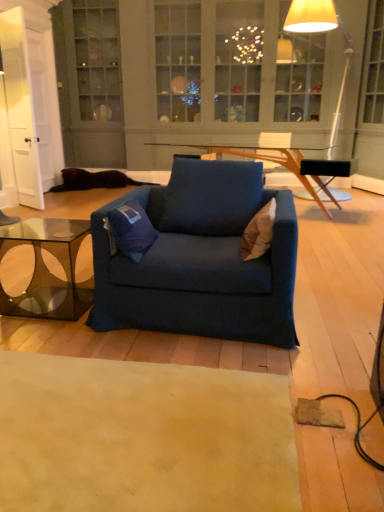
Question: Can you confirm if matte white floor lamp at upper right is smaller than blue fabric pillow at center, the 2th pillow when ordered from right to left?

Choices:
 (A) yes
 (B) no

Answer: (B)

Question: Is matte white floor lamp at upper right positioned beyond the bounds of blue fabric pillow at center, the first pillow from the left?

Choices:
 (A) yes
 (B) no

Answer: (A)

Question: Considering the relative sizes of matte white floor lamp at upper right and blue fabric pillow at center, the first pillow from the left, in the image provided, is matte white floor lamp at upper right taller than blue fabric pillow at center, the first pillow from the left,?

Choices:
 (A) yes
 (B) no

Answer: (A)

Question: Considering the relative sizes of matte white floor lamp at upper right and blue fabric pillow at center, the first pillow from the left, in the image provided, is matte white floor lamp at upper right wider than blue fabric pillow at center, the first pillow from the left,?

Choices:
 (A) yes
 (B) no

Answer: (A)

Question: Is matte white floor lamp at upper right oriented away from blue fabric pillow at center, the first pillow from the left?

Choices:
 (A) yes
 (B) no

Answer: (B)

Question: Does matte white floor lamp at upper right have a larger size compared to blue fabric pillow at center, the 2th pillow when ordered from right to left?

Choices:
 (A) yes
 (B) no

Answer: (A)

Question: Could you tell me if blue fabric chair at center is facing white glossy door at left?

Choices:
 (A) no
 (B) yes

Answer: (A)

Question: From a real-world perspective, is blue fabric chair at center positioned over white glossy door at left based on gravity?

Choices:
 (A) yes
 (B) no

Answer: (B)

Question: From the image's perspective, would you say blue fabric chair at center is shown under white glossy door at left?

Choices:
 (A) no
 (B) yes

Answer: (B)

Question: Would you say blue fabric chair at center contains white glossy door at left?

Choices:
 (A) yes
 (B) no

Answer: (B)

Question: Considering the relative sizes of blue fabric chair at center and white glossy door at left in the image provided, is blue fabric chair at center smaller than white glossy door at left?

Choices:
 (A) no
 (B) yes

Answer: (A)

Question: Is blue fabric chair at center to the left of white glossy door at left from the viewer's perspective?

Choices:
 (A) no
 (B) yes

Answer: (A)

Question: Considering the relative sizes of transparent glass coffee table at lower left and beige fabric pillow at center, marked as the 1th pillow in a right-to-left arrangement, in the image provided, is transparent glass coffee table at lower left shorter than beige fabric pillow at center, marked as the 1th pillow in a right-to-left arrangement,?

Choices:
 (A) yes
 (B) no

Answer: (B)